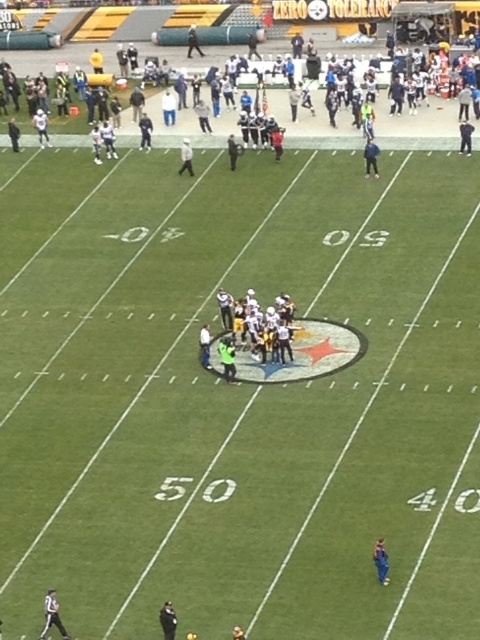
You are a photographer positioned at the 50 yard line. You want to take a photo of the blue fabric person at lower right and the white matte helmet at center so that both are in frame. Which direction should you move to ensure both subjects are visible?

The blue fabric person at lower right is to the right of the white matte helmet at center. To include both in your photo, move to the left so that you can capture both the blue fabric person at lower right and the white matte helmet at center within the frame.

You are standing at the center of the football field where the red star logo is. You need to locate the black fabric person at lower left. In which direction should you move relative to your current position?

You should move towards the lower left direction from the center of the football field where the red star logo is to locate the black fabric person at lower left.

You are a photographer positioned at the 50 yard line on the football field. You want to take a photo of the dark blue uniform at center and the black fabric person at lower left. Which one will appear closer to the camera in the photo?

The black fabric person at lower left is in front of the dark blue uniform at center, so in the photo taken from the 50 yard line, the black fabric person at lower left will appear closer to the camera.